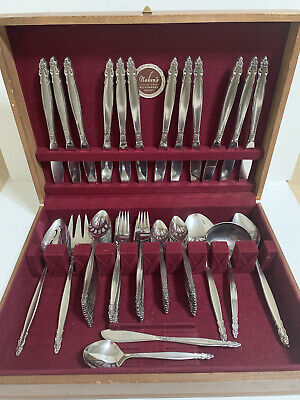
This screenshot has width=300, height=400. In order to click on strainer spoons in this screenshot , I will do `click(57, 239)`, `click(96, 224)`, `click(155, 231)`, `click(175, 230)`.